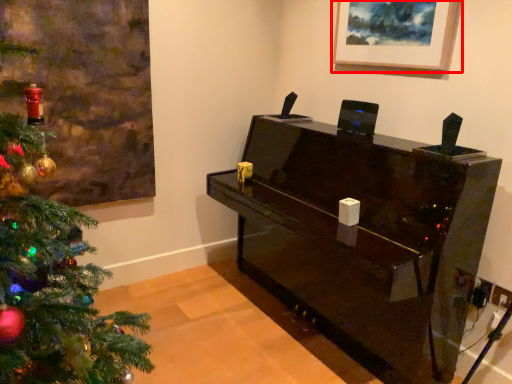
Question: Considering the relative positions of picture frame (annotated by the red box) and furniture in the image provided, where is picture frame (annotated by the red box) located with respect to the staircase?

Choices:
 (A) right
 (B) left

Answer: (A)